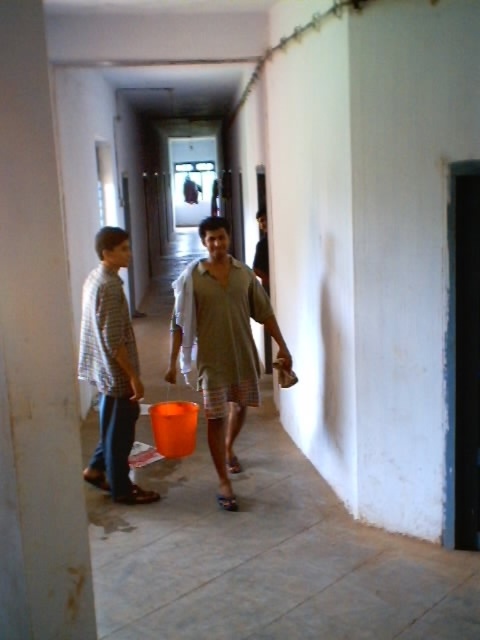
Consider the image. You are a maintenance worker carrying a large box that is 1 meter wide. You need to walk through the corridor and pass between the white painted pillar at left and the matte khaki shirt at center. Can your box fit through the space between them?

The white painted pillar at left has a lesser width compared to matte khaki shirt at center. Since the pillar is narrower, the space between them might be sufficient for the box, but the exact width isn

You are standing in the corridor and want to walk to the door at the end. There is a white painted pillar at left located at point [36,358]. Can you walk around it on the right side?

Yes, you can walk around the white painted pillar at left on the right side since it is positioned at point [36,358], which allows for space to navigate around it.